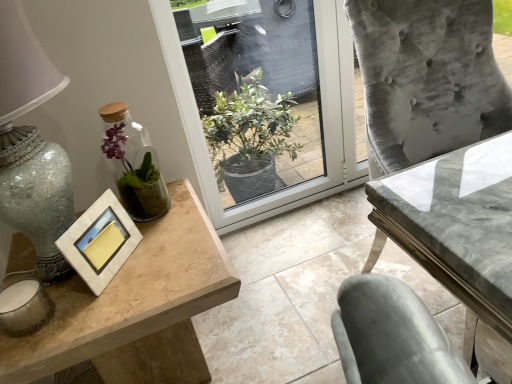
I want to click on free space above wooden table at left, which is the 1th table in left-to-right order (from a real-world perspective), so click(128, 267).